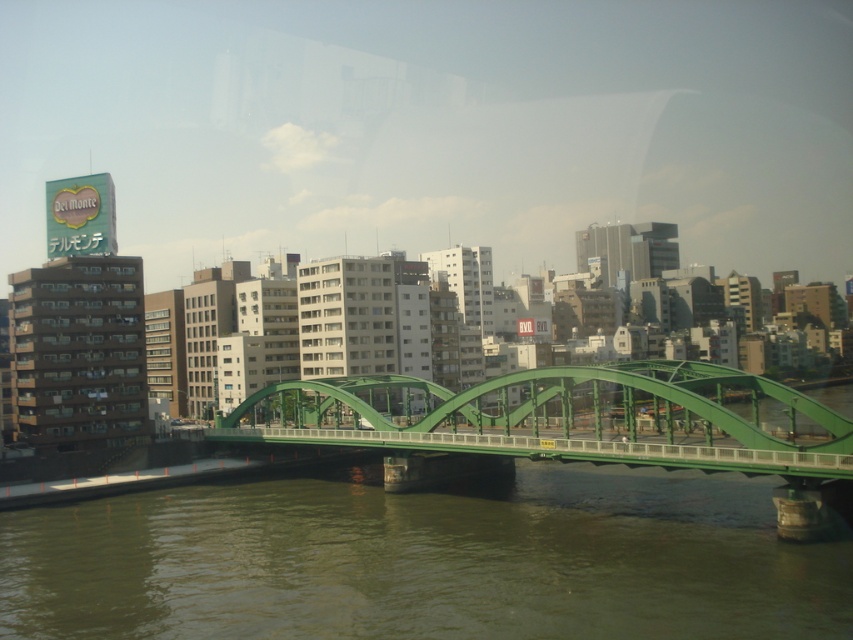
Based on the scene description, where is the point located at coordinates (424, 561)?

The point at coordinates (424, 561) is located at the green concrete river at center.

Based on the photo, you are a photographer planning to capture the green metallic bridge at center and the green concrete river at center in a single shot. Based on their positions, can you determine which one will naturally appear smaller in the photo?

The green concrete river at center is below the green metallic bridge at center, so the bridge will appear larger in the photo due to its closer proximity to the camera compared to the river which is further away.

You are a city planner assessing the space between the green concrete river at center and the green metallic bridge at center. Given that the minimum required distance for safety regulations is 30 feet, is the current distance compliant?

The distance between the green concrete river at center and the green metallic bridge at center is 32.17 feet, which exceeds the minimum required 30 feet for safety regulations. Therefore, the current distance is compliant.